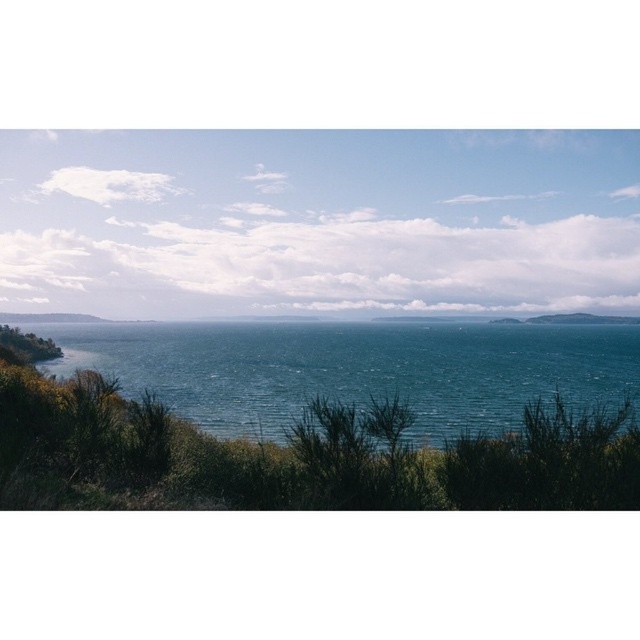
Question: Does teal glossy water at center have a lesser width compared to blue water at center?

Choices:
 (A) yes
 (B) no

Answer: (A)

Question: Is teal glossy water at center closer to the viewer compared to blue water at center?

Choices:
 (A) no
 (B) yes

Answer: (B)

Question: Which point is closer to the camera taking this photo?

Choices:
 (A) (336, 316)
 (B) (308, 365)

Answer: (B)

Question: Where is teal glossy water at center located in relation to blue water at center in the image?

Choices:
 (A) left
 (B) right

Answer: (B)